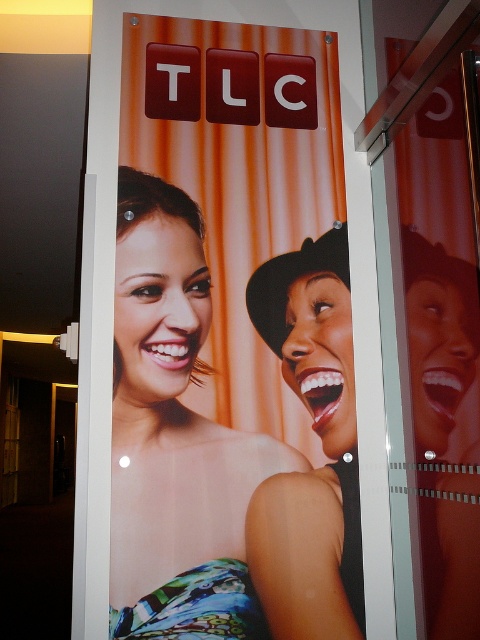
In the scene shown: Does matte skin tone woman at center appear under smooth black hat at right?

No, matte skin tone woman at center is not below smooth black hat at right.

Who is positioned more to the right, matte skin tone woman at center or smooth black hat at right?

From the viewer's perspective, smooth black hat at right appears more on the right side.

Between point (168, 516) and point (291, 506), which one is positioned behind?

Positioned behind is point (291, 506).

Where is `matte skin tone woman at center`? matte skin tone woman at center is located at coordinates (175, 436).